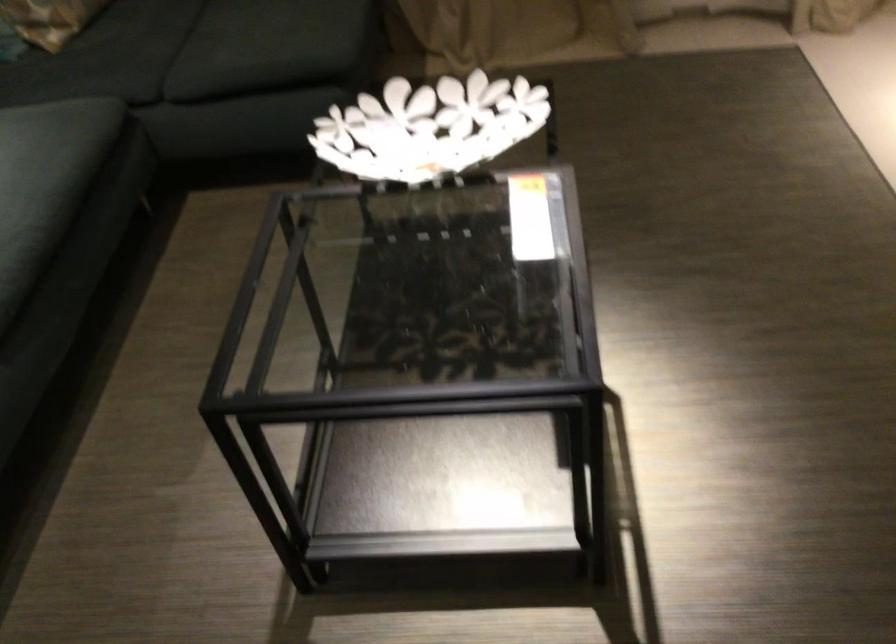
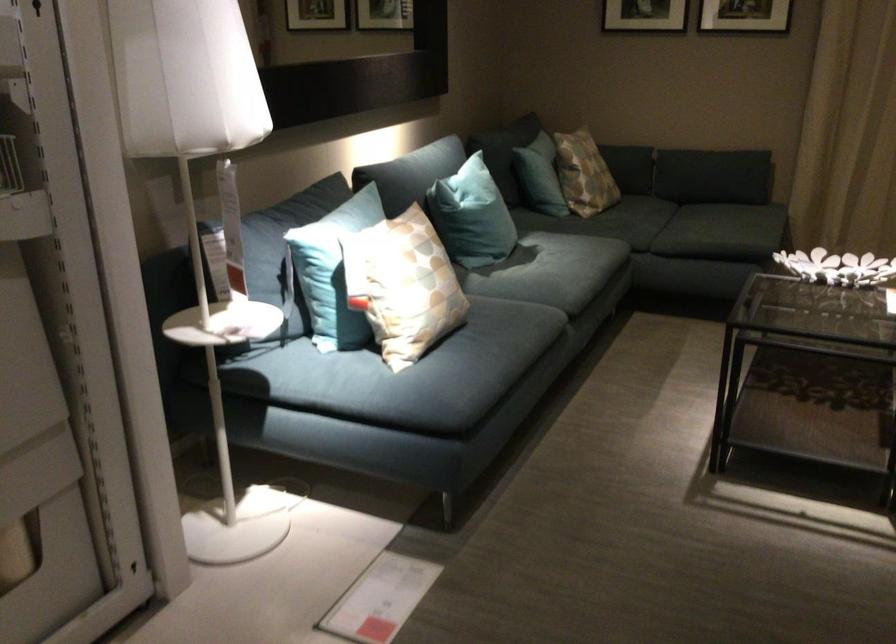
The point at (427, 158) is marked in the first image. Where is the corresponding point in the second image?

(837, 267)